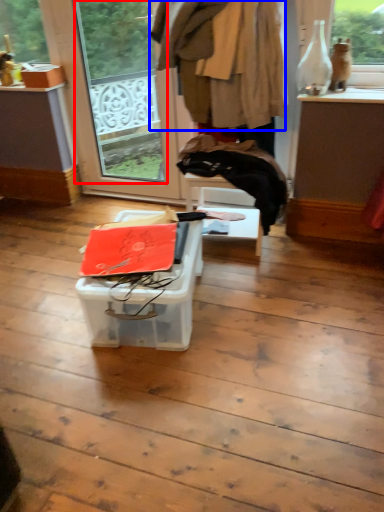
Question: Which point is further to the camera, window screen (highlighted by a red box) or clothing (highlighted by a blue box)?

Choices:
 (A) window screen
 (B) clothing

Answer: (A)